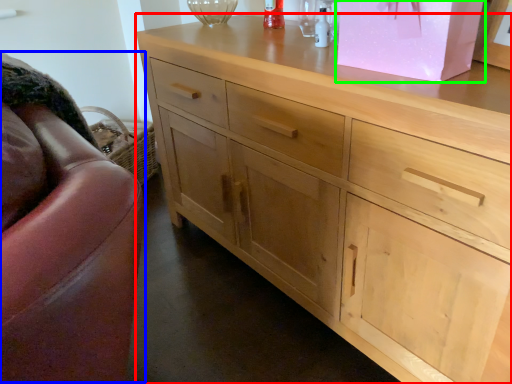
Question: Which object is the closest to the chest of drawers (highlighted by a red box)? Choose among these: swivel chair (highlighted by a blue box) or cabinetry (highlighted by a green box).

Choices:
 (A) swivel chair
 (B) cabinetry

Answer: (B)